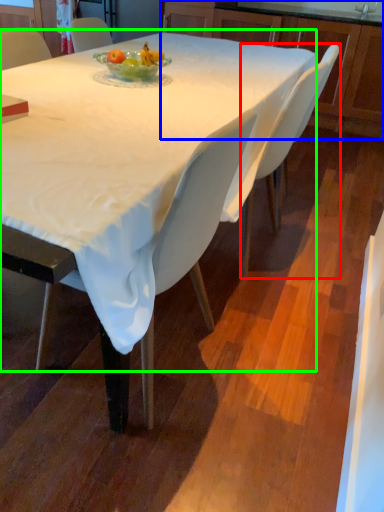
Question: Which is farther away from chair (highlighted by a red box)? cabinetry (highlighted by a blue box) or round table (highlighted by a green box)?

Choices:
 (A) cabinetry
 (B) round table

Answer: (A)